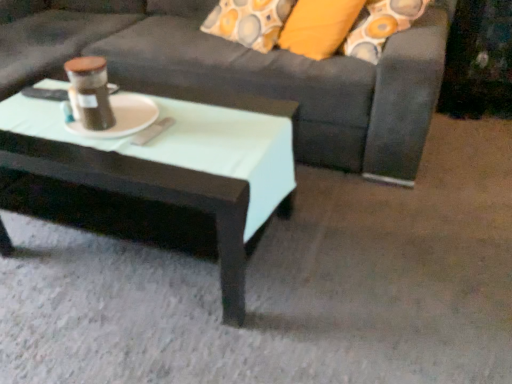
Where is `free space in front of white matte platter at center`? This screenshot has width=512, height=384. free space in front of white matte platter at center is located at coordinates (117, 153).